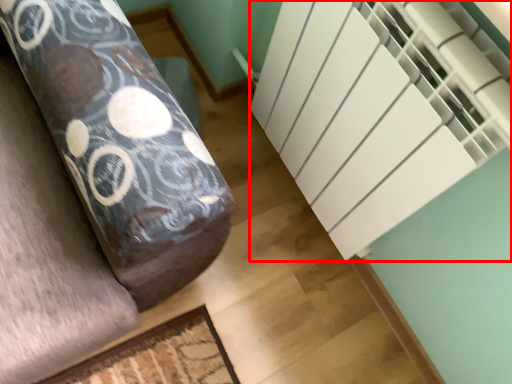
Question: Where is stairwell (annotated by the red box) located in relation to furniture in the image?

Choices:
 (A) left
 (B) right

Answer: (B)